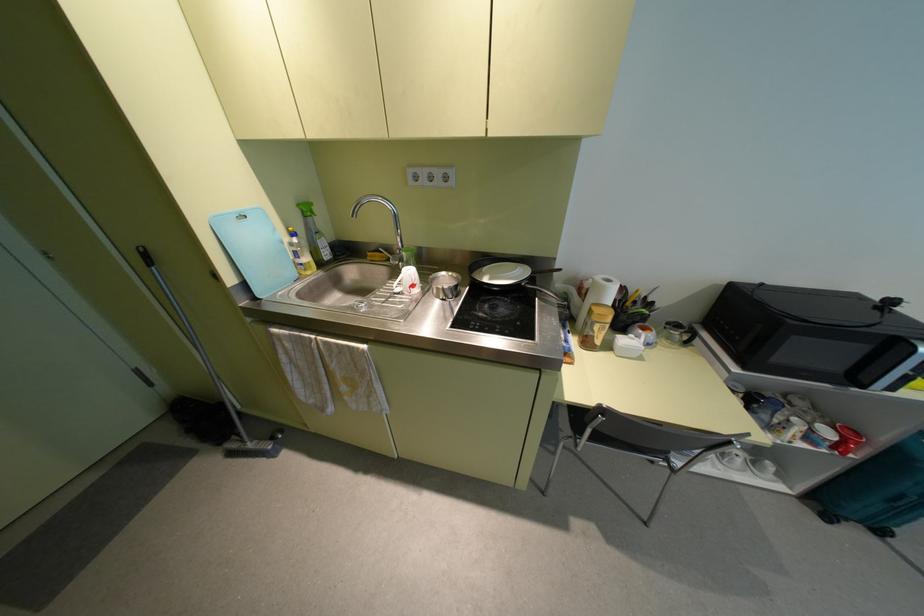
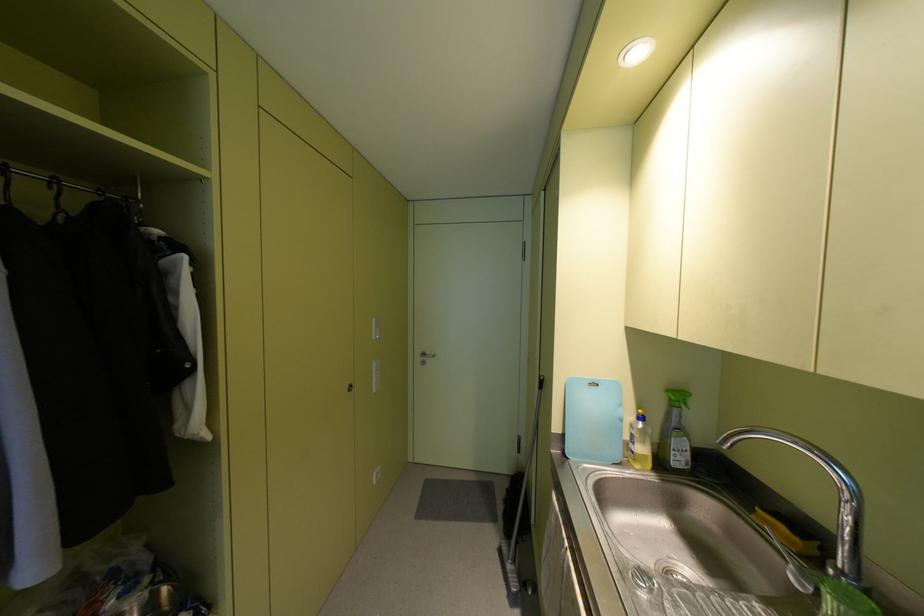
Locate, in the second image, the point that corresponds to [293,233] in the first image.

(640, 416)